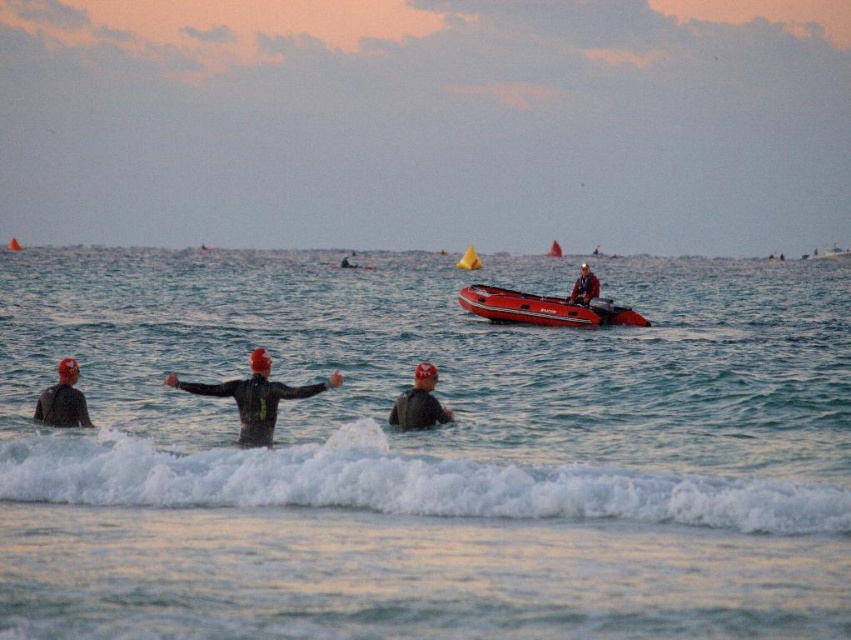
Question: Is black wetsuit at left to the left of matte red life jacket at center from the viewer's perspective?

Choices:
 (A) no
 (B) yes

Answer: (B)

Question: Considering the real-world distances, which object is closest to the matte red life jacket at center?

Choices:
 (A) clear water at center
 (B) matte black wetsuit at center
 (C) white foamy wave at lower center

Answer: (A)

Question: Where is rubberized red boat at center located in relation to black wetsuit at left in the image?

Choices:
 (A) above
 (B) below

Answer: (A)

Question: Is clear water at center further to the viewer compared to rubberized red boat at center?

Choices:
 (A) yes
 (B) no

Answer: (B)

Question: Among these objects, which one is farthest from the camera?

Choices:
 (A) matte red life jacket at center
 (B) matte black wetsuit at center

Answer: (A)

Question: Which of these objects is positioned closest to the matte red life jacket at center?

Choices:
 (A) clear water at center
 (B) rubberized red boat at center
 (C) white foamy wave at lower center
 (D) black wetsuit at left

Answer: (B)